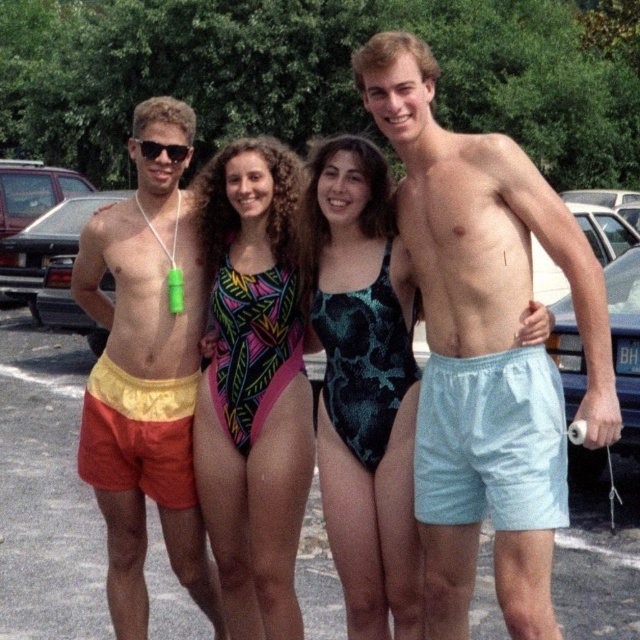
Question: Can you confirm if matte yellow swim shorts at left is wider than black plastic sunglasses at left?

Choices:
 (A) no
 (B) yes

Answer: (B)

Question: Which object is farther from the camera taking this photo?

Choices:
 (A) neon geometric swimsuit at center
 (B) black plastic sunglasses at left
 (C) teal patterned swimsuit at center
 (D) matte yellow swim shorts at left

Answer: (D)

Question: Considering the real-world distances, which object is farthest from the teal patterned swimsuit at center?

Choices:
 (A) matte yellow swim shorts at left
 (B) light blue fabric shorts at right
 (C) neon geometric swimsuit at center
 (D) black plastic sunglasses at left

Answer: (D)

Question: Which point is farther to the camera?

Choices:
 (A) (211, 225)
 (B) (180, 145)
 (C) (461, 524)
 (D) (374, 464)

Answer: (A)

Question: Is matte yellow swim shorts at left below black plastic sunglasses at left?

Choices:
 (A) yes
 (B) no

Answer: (A)

Question: Considering the relative positions of matte yellow swim shorts at left and black plastic sunglasses at left in the image provided, where is matte yellow swim shorts at left located with respect to black plastic sunglasses at left?

Choices:
 (A) above
 (B) below

Answer: (B)